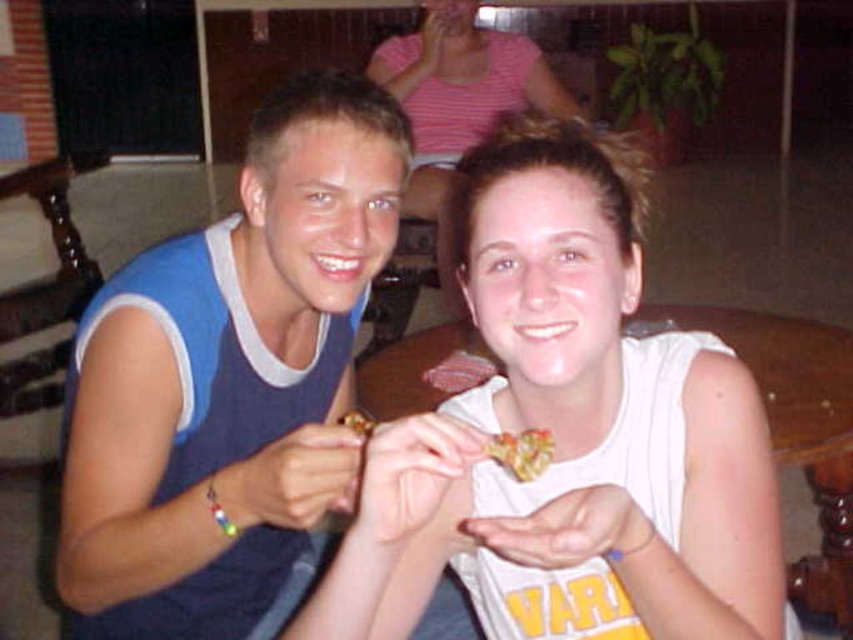
You are a chef who needs to place a new dish between the white matte food at center and the shiny metallic snack at center. The dish requires 15 centimeters of space. Can you fit it between them?

The distance between the white matte food at center and the shiny metallic snack at center is 14.18 centimeters, which is less than the required 15 centimeters. Therefore, the dish cannot be placed between them.

You are a food delivery robot that needs to deliver a white matte food at center to a customer. The customer is standing at point (567, 436). Can you reach them directly without moving around any obstacles?

The white matte food at center is located at point (567, 436), so yes, the robot can reach them directly since the customer is at the same location as the food.